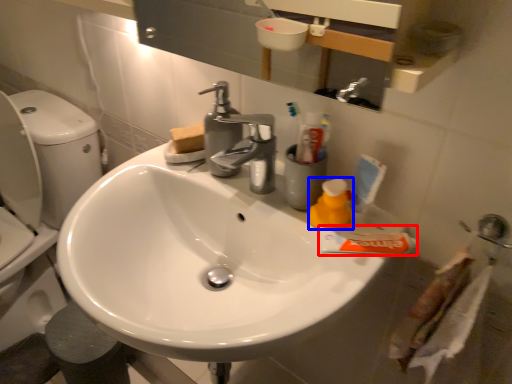
Question: Which of the following is the closest to the observer, toothpaste (highlighted by a red box) or cleaning product (highlighted by a blue box)?

Choices:
 (A) toothpaste
 (B) cleaning product

Answer: (A)